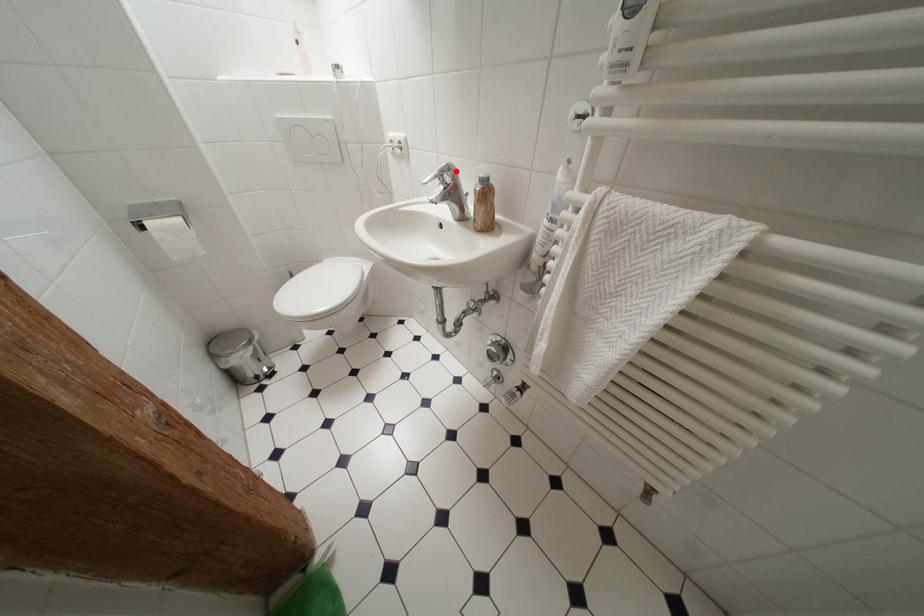
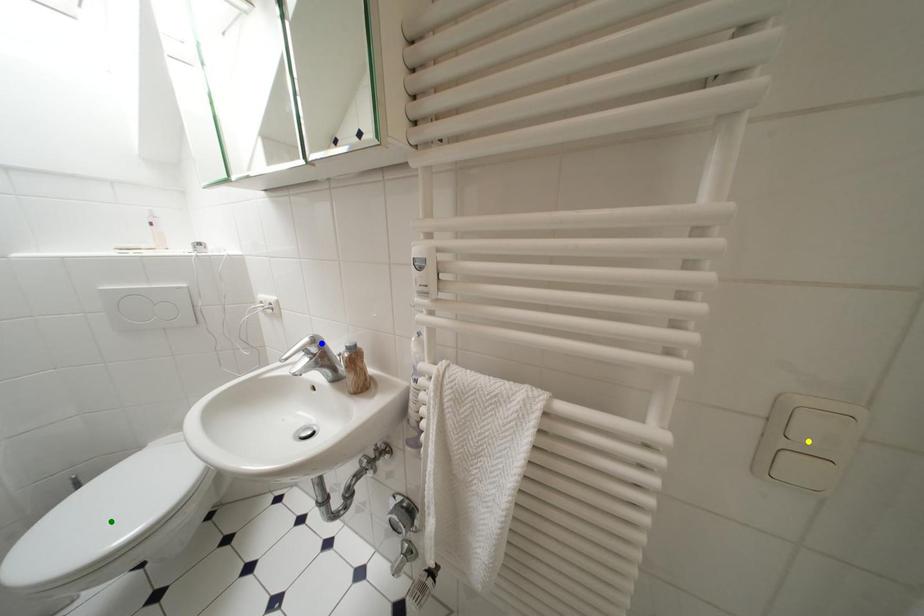
Question: I am providing you with two images of the same scene from different viewpoints. A red point is marked on the first image. You are given multiple points on the second image. Which point in image 2 represents the same 3d spot as the red point in image 1?

Choices:
 (A) green point
 (B) blue point
 (C) yellow point

Answer: (B)